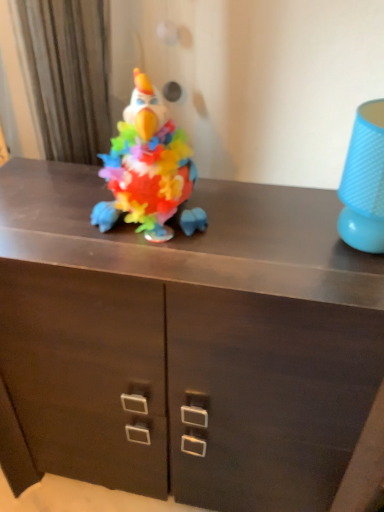
Question: From the image's perspective, is plush multicolored parrot at center located beneath wooden cabinet at center?

Choices:
 (A) yes
 (B) no

Answer: (B)

Question: Is plush multicolored parrot at center to the left of wooden cabinet at center from the viewer's perspective?

Choices:
 (A) yes
 (B) no

Answer: (A)

Question: Is plush multicolored parrot at center outside of wooden cabinet at center?

Choices:
 (A) no
 (B) yes

Answer: (B)

Question: Is plush multicolored parrot at center positioned behind wooden cabinet at center?

Choices:
 (A) yes
 (B) no

Answer: (A)

Question: Is plush multicolored parrot at center turned away from wooden cabinet at center?

Choices:
 (A) yes
 (B) no

Answer: (B)

Question: Would you say plush multicolored parrot at center is to the left or to the right of blue textured lampshade at right in the picture?

Choices:
 (A) right
 (B) left

Answer: (B)

Question: Is plush multicolored parrot at center situated inside blue textured lampshade at right or outside?

Choices:
 (A) outside
 (B) inside

Answer: (A)

Question: Is point (142, 140) closer or farther from the camera than point (382, 135)?

Choices:
 (A) farther
 (B) closer

Answer: (A)

Question: Is plush multicolored parrot at center in front of or behind blue textured lampshade at right in the image?

Choices:
 (A) behind
 (B) front

Answer: (A)

Question: Is blue textured lampshade at right inside the boundaries of wooden cabinet at center, or outside?

Choices:
 (A) inside
 (B) outside

Answer: (B)

Question: Looking at the image, does blue textured lampshade at right seem bigger or smaller compared to wooden cabinet at center?

Choices:
 (A) small
 (B) big

Answer: (A)

Question: Relative to wooden cabinet at center, is blue textured lampshade at right in front or behind?

Choices:
 (A) front
 (B) behind

Answer: (A)

Question: From the image's perspective, is blue textured lampshade at right located above or below wooden cabinet at center?

Choices:
 (A) above
 (B) below

Answer: (A)

Question: Visually, is wooden cabinet at center positioned to the left or to the right of plush multicolored parrot at center?

Choices:
 (A) left
 (B) right

Answer: (B)

Question: Is wooden cabinet at center inside or outside of plush multicolored parrot at center?

Choices:
 (A) outside
 (B) inside

Answer: (A)